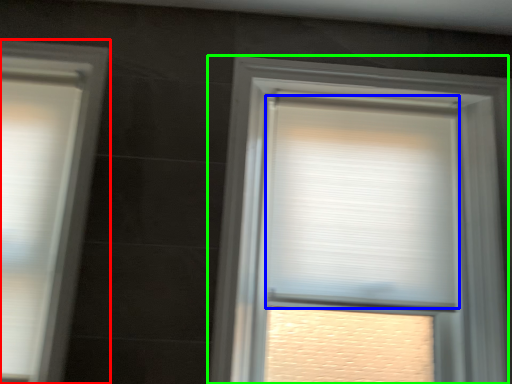
Question: Which is farther away from window (highlighted by a red box)? window blind (highlighted by a blue box) or window (highlighted by a green box)?

Choices:
 (A) window blind
 (B) window

Answer: (A)